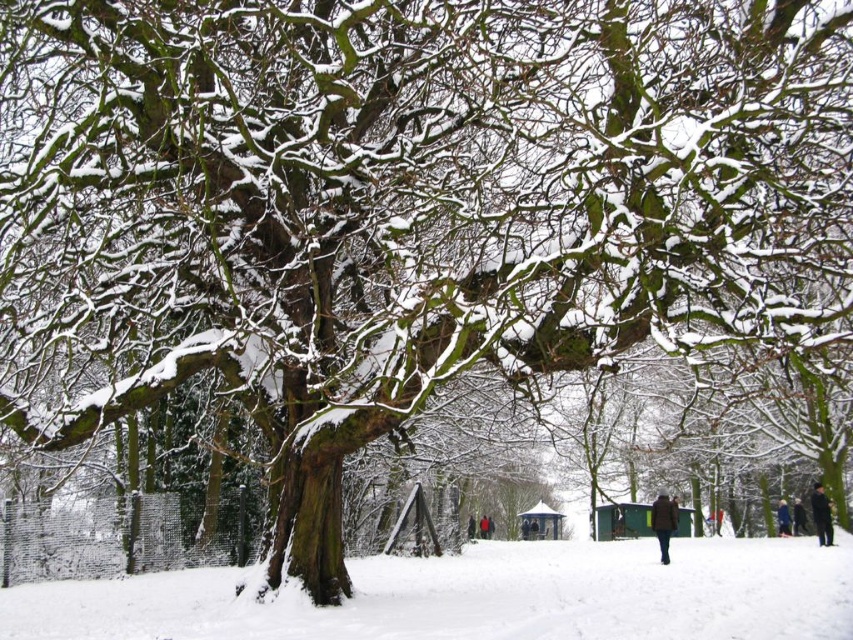
You are planning to build a snowman in the park. You see the white fluffy snow at lower center and the black fabric person at lower right. Which area has enough space for the snowman?

The white fluffy snow at lower center has a greater width than the black fabric person at lower right, so the area with white fluffy snow at lower center has enough space for the snowman.

You are standing at the edge of the snowy park and see both the black fabric person at lower right and the dark blue jacket at lower right. Which one is closer to the left side of the scene?

The black fabric person at lower right is positioned on the left side of dark blue jacket at lower right, so it is closer to the left side of the scene.